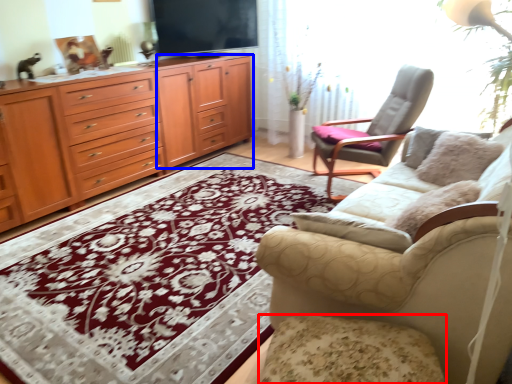
Question: Which of the following is the farthest to the observer, footrest (highlighted by a red box) or tv cabinet (highlighted by a blue box)?

Choices:
 (A) footrest
 (B) tv cabinet

Answer: (B)